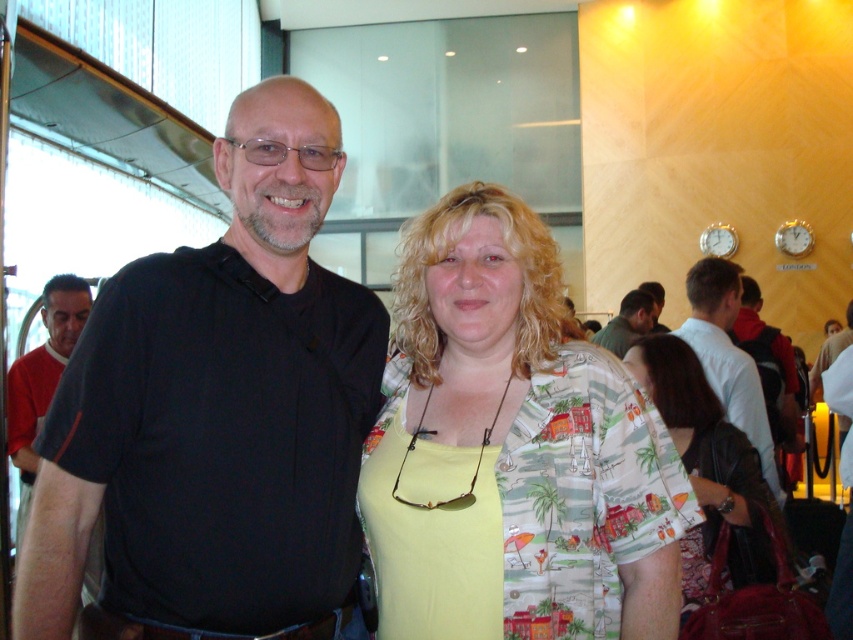
Question: Can you confirm if printed fabric shirt at center is bigger than dark brown hair at center?

Choices:
 (A) no
 (B) yes

Answer: (B)

Question: Among these points, which one is nearest to the camera?

Choices:
 (A) (601, 330)
 (B) (654, 296)
 (C) (616, 609)

Answer: (C)

Question: Which of the following is the farthest from the observer?

Choices:
 (A) printed fabric shirt at center
 (B) red sweater at left

Answer: (B)

Question: Does black polo shirt at center have a larger size compared to green fabric shirt at center?

Choices:
 (A) yes
 (B) no

Answer: (B)

Question: Can you confirm if printed fabric shirt at right is positioned above red sweater at left?

Choices:
 (A) yes
 (B) no

Answer: (B)

Question: Which of the following is the farthest from the observer?

Choices:
 (A) printed fabric shirt at center
 (B) green fabric shirt at center
 (C) red sweater at left
 (D) white shirt at right

Answer: (B)